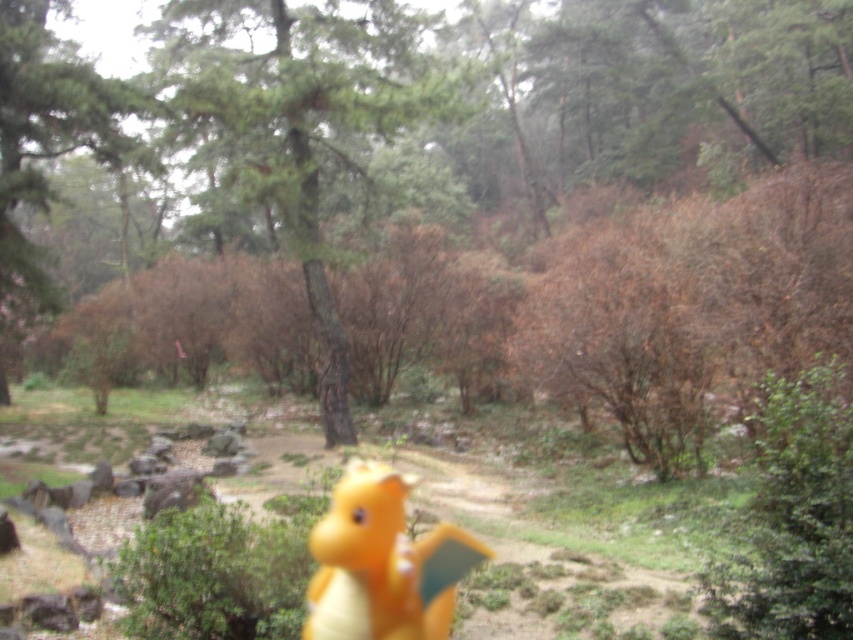
Looking at this image, does green matte tree at center have a greater height compared to green matte tree at upper left?

Correct, green matte tree at center is much taller as green matte tree at upper left.

Describe the element at coordinates (582, 163) in the screenshot. I see `green matte tree at center` at that location.

Find the location of a particular element. The height and width of the screenshot is (640, 853). green matte tree at center is located at coordinates (582, 163).

Can you confirm if green matte tree at center is shorter than orange matte toy dragon at center?

Incorrect, green matte tree at center's height does not fall short of orange matte toy dragon at center's.

Is green matte tree at center positioned behind orange matte toy dragon at center?

Yes, green matte tree at center is further from the viewer.

Is point (758, 115) positioned behind point (321, 529)?

Yes, point (758, 115) is farther from viewer.

Find the location of a particular element. green matte tree at center is located at coordinates (582, 163).

Between point (410, 168) and point (219, 108), which one is positioned behind?

The point (410, 168) is behind.

Between point (325, 360) and point (405, 45), which one is positioned behind?

Positioned behind is point (405, 45).

The width and height of the screenshot is (853, 640). I want to click on green matte tree at center, so click(582, 163).